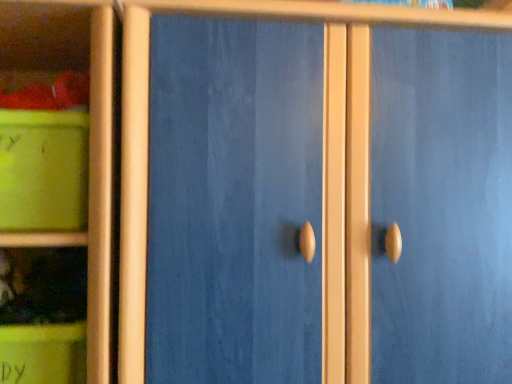
Question: Does green matte container at lower left have a greater height compared to matte green plastic container at left?

Choices:
 (A) no
 (B) yes

Answer: (A)

Question: Considering the relative sizes of green matte container at lower left and matte green plastic container at left in the image provided, is green matte container at lower left thinner than matte green plastic container at left?

Choices:
 (A) no
 (B) yes

Answer: (B)

Question: Can you confirm if green matte container at lower left is shorter than matte green plastic container at left?

Choices:
 (A) no
 (B) yes

Answer: (B)

Question: Does green matte container at lower left appear on the left side of matte green plastic container at left?

Choices:
 (A) no
 (B) yes

Answer: (A)

Question: Could you tell me if green matte container at lower left is facing matte green plastic container at left?

Choices:
 (A) yes
 (B) no

Answer: (B)

Question: Can you confirm if green matte container at lower left is bigger than matte green plastic container at left?

Choices:
 (A) yes
 (B) no

Answer: (B)

Question: Is matte green plastic container at left shorter than green matte container at lower left?

Choices:
 (A) yes
 (B) no

Answer: (B)

Question: Is matte green plastic container at left touching green matte container at lower left?

Choices:
 (A) yes
 (B) no

Answer: (B)

Question: From a real-world perspective, is matte green plastic container at left on green matte container at lower left?

Choices:
 (A) no
 (B) yes

Answer: (B)

Question: Can you confirm if matte green plastic container at left is smaller than green matte container at lower left?

Choices:
 (A) yes
 (B) no

Answer: (B)

Question: Does matte green plastic container at left have a greater width compared to green matte container at lower left?

Choices:
 (A) yes
 (B) no

Answer: (A)

Question: Can you confirm if matte green plastic container at left is bigger than green matte container at lower left?

Choices:
 (A) no
 (B) yes

Answer: (B)

Question: From the image's perspective, is matte green plastic container at left positioned above or below green matte container at lower left?

Choices:
 (A) above
 (B) below

Answer: (A)